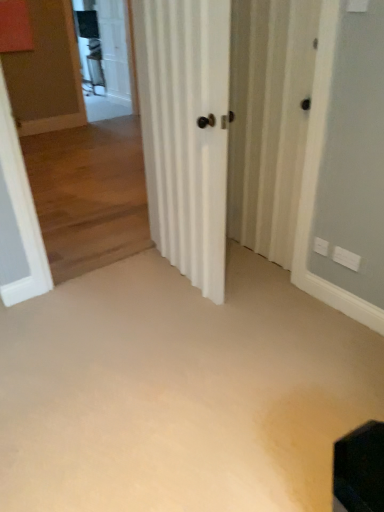
Question: From the image's perspective, is beige carpet at center located beneath white matte door at center?

Choices:
 (A) no
 (B) yes

Answer: (B)

Question: Can you confirm if beige carpet at center is shorter than white matte door at center?

Choices:
 (A) yes
 (B) no

Answer: (A)

Question: Is beige carpet at center thinner than white matte door at center?

Choices:
 (A) yes
 (B) no

Answer: (B)

Question: Is beige carpet at center oriented away from white matte door at center?

Choices:
 (A) yes
 (B) no

Answer: (B)

Question: Can you confirm if beige carpet at center is wider than white matte door at center?

Choices:
 (A) yes
 (B) no

Answer: (A)

Question: From the image's perspective, is clear glass screen door at upper left, the 2th screen door when ordered from front to back, located above or below white striped screen door at center, the first screen door viewed from the right?

Choices:
 (A) below
 (B) above

Answer: (B)

Question: From a real-world perspective, is clear glass screen door at upper left, the 2th screen door in the right-to-left sequence, physically located above or below white striped screen door at center, which is counted as the first screen door, starting from the bottom?

Choices:
 (A) above
 (B) below

Answer: (A)

Question: Does point (117, 7) appear closer or farther from the camera than point (291, 99)?

Choices:
 (A) farther
 (B) closer

Answer: (A)

Question: Is clear glass screen door at upper left, the 2th screen door in the right-to-left sequence, wider or thinner than white striped screen door at center, acting as the 2th screen door starting from the left?

Choices:
 (A) thin
 (B) wide

Answer: (B)

Question: Looking at their shapes, would you say white matte door at center is wider or thinner than clear glass screen door at upper left, the first screen door positioned from the left?

Choices:
 (A) wide
 (B) thin

Answer: (A)

Question: From the image's perspective, is white matte door at center above or below clear glass screen door at upper left, the 2th screen door when ordered from front to back?

Choices:
 (A) below
 (B) above

Answer: (A)

Question: Is white matte door at center to the left or to the right of clear glass screen door at upper left, the 2th screen door when ordered from front to back, in the image?

Choices:
 (A) right
 (B) left

Answer: (A)

Question: Considering the positions of white matte door at center and clear glass screen door at upper left, which appears as the 1th screen door when viewed from the top, in the image, is white matte door at center taller or shorter than clear glass screen door at upper left, which appears as the 1th screen door when viewed from the top,?

Choices:
 (A) short
 (B) tall

Answer: (A)

Question: In terms of size, does beige carpet at center appear bigger or smaller than white matte door at center?

Choices:
 (A) small
 (B) big

Answer: (A)

Question: Which is correct: beige carpet at center is inside white matte door at center, or outside of it?

Choices:
 (A) inside
 (B) outside

Answer: (B)